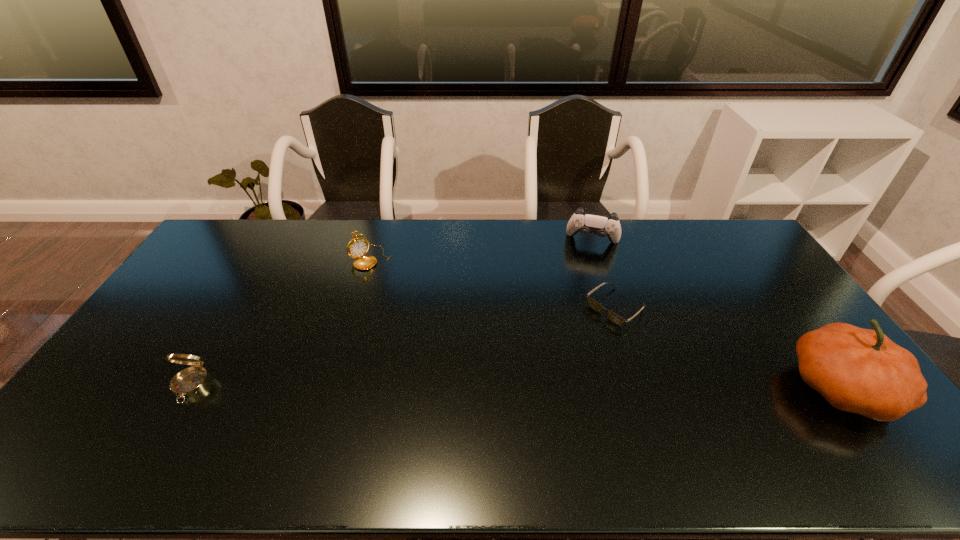
This screenshot has width=960, height=540. Identify the location of vacant area between the control and the shortest object. (604, 274).

Identify the location of vacant space in between the control and the pumpkin. (717, 314).

You are a GUI agent. You are given a task and a screenshot of the screen. Output one action in this format:
    pyautogui.click(x=<x>, y=<y>)
    Task: Click on the free space between the rightmost object and the shortest object
    
    Given the screenshot: What is the action you would take?
    pyautogui.click(x=729, y=347)

The image size is (960, 540). I want to click on free space that is in between the compass and the control, so click(392, 313).

Find the location of a particular element. This screenshot has height=540, width=960. vacant space that is in between the control and the pumpkin is located at coordinates (717, 314).

At what (x,y) coordinates should I click in order to perform the action: click on free space between the leftmost object and the tallest object. Please return your answer as a coordinate pair (x, y). Looking at the image, I should click on (516, 387).

Identify the location of unoccupied area between the fourth object from right to left and the control. (482, 249).

Find the location of a particular element. free spot between the control and the compass is located at coordinates (392, 313).

Locate an element on the screen. This screenshot has width=960, height=540. object that is the third nearest to the compass is located at coordinates (602, 225).

Identify the location of the second closest object to the sunglasses. (857, 370).